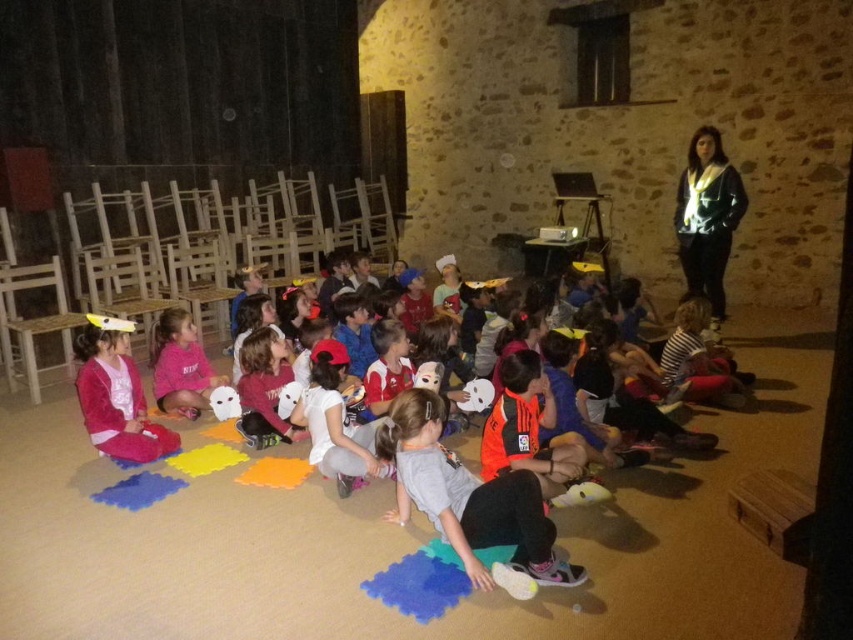
Can you confirm if orange jersey at center is taller than pink fleece sweatshirt at center?

Indeed, orange jersey at center has a greater height compared to pink fleece sweatshirt at center.

Is point (424, 442) more distant than point (165, 376)?

No, it is in front of (165, 376).

Is point (399, 420) positioned behind point (190, 330)?

No, (399, 420) is closer to viewer.

Where is `orange jersey at center`? Image resolution: width=853 pixels, height=640 pixels. orange jersey at center is located at coordinates (468, 497).

Does orange jersey at center appear on the right side of pink fabric mask at lower left?

Yes, orange jersey at center is to the right of pink fabric mask at lower left.

Looking at this image, who is taller, orange jersey at center or pink fabric mask at lower left?

pink fabric mask at lower left is taller.

Locate an element on the screen. This screenshot has width=853, height=640. orange jersey at center is located at coordinates (468, 497).

Who is more distant from viewer, [117,317] or [166,314]?

The point [166,314] is behind.

In the scene shown: Can you confirm if pink fabric mask at lower left is bigger than pink fleece sweatshirt at center?

No.

What do you see at coordinates (115, 394) in the screenshot?
I see `pink fabric mask at lower left` at bounding box center [115, 394].

Where is `pink fabric mask at lower left`? The height and width of the screenshot is (640, 853). pink fabric mask at lower left is located at coordinates (115, 394).